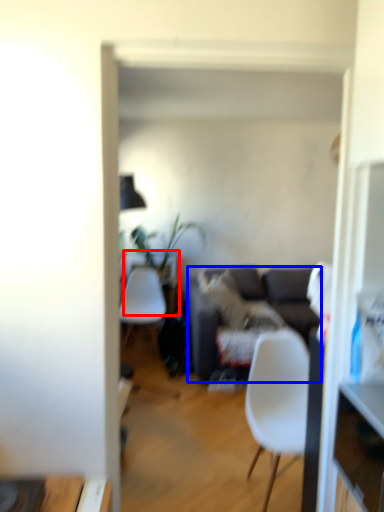
Question: Among these objects, which one is farthest to the camera, desk (highlighted by a red box) or studio couch (highlighted by a blue box)?

Choices:
 (A) desk
 (B) studio couch

Answer: (A)